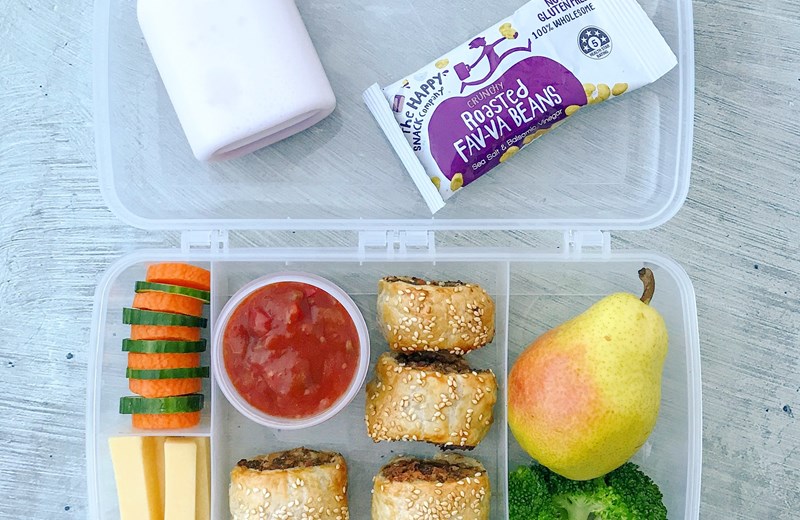
Locate an element on the screen. The image size is (800, 520). table is located at coordinates (730, 221), (726, 321), (28, 254), (42, 153).